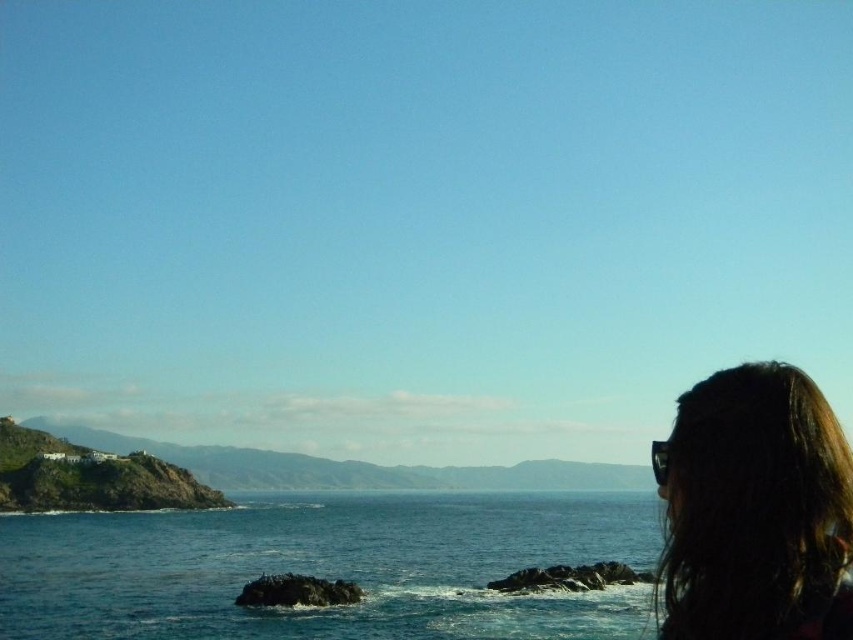
Based on the photo, you are standing on the beach and want to take a photo of the dark hair at upper right and the blue water at center. Which object should you focus on first if you want to capture both in a single frame without moving the camera?

You should focus on the blue water at center first because it is closer to you than the dark hair at upper right, allowing both to be in focus when using a single focal point.

You are a drone operator trying to capture the blue water at center in the image. To ensure the water is centered in your shot, where should you position the drone relative to the image frame?

The blue water at center is located at point 2D coordinates of 0.887 on the x axis and 0.386 on the y axis. To center it, position the drone so the water aligns with the center point of the image frame.

You are standing at the coastal settlement on the left and want to reach the distant landmass. Which point, point (590, 496) or point (770, 625), is closer to you?

Point (590, 496) is closer to you because it is further to the viewer than point (770, 625).